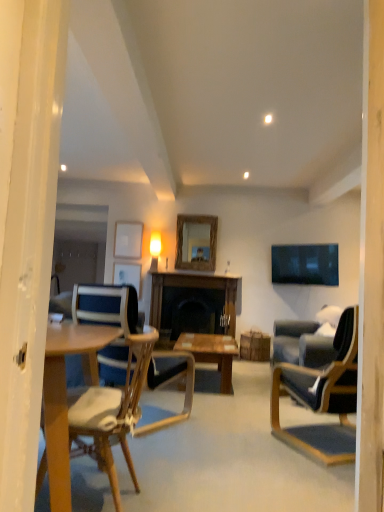
Question: Considering the relative sizes of wooden chair at center, which ranks as the first chair in left-to-right order, and rustic wood mirror at center in the image provided, is wooden chair at center, which ranks as the first chair in left-to-right order, shorter than rustic wood mirror at center?

Choices:
 (A) no
 (B) yes

Answer: (A)

Question: Is wooden chair at center, the second chair in the right-to-left sequence, outside rustic wood mirror at center?

Choices:
 (A) yes
 (B) no

Answer: (A)

Question: Can you confirm if wooden chair at center, which ranks as the first chair in left-to-right order, is thinner than rustic wood mirror at center?

Choices:
 (A) no
 (B) yes

Answer: (A)

Question: Would you say wooden chair at center, which ranks as the first chair in left-to-right order, contains rustic wood mirror at center?

Choices:
 (A) yes
 (B) no

Answer: (B)

Question: Is wooden chair at center, which ranks as the first chair in left-to-right order, facing away from rustic wood mirror at center?

Choices:
 (A) no
 (B) yes

Answer: (A)

Question: Is rustic wood mirror at center situated inside matte wooden picture frame at upper center, arranged as the 1th picture frame when ordered from the bottom, or outside?

Choices:
 (A) inside
 (B) outside

Answer: (B)

Question: From the image's perspective, is rustic wood mirror at center positioned above or below matte wooden picture frame at upper center, arranged as the 1th picture frame when ordered from the bottom?

Choices:
 (A) below
 (B) above

Answer: (B)

Question: In terms of width, does rustic wood mirror at center look wider or thinner when compared to matte wooden picture frame at upper center, the 2th picture frame in the top-to-bottom sequence?

Choices:
 (A) wide
 (B) thin

Answer: (A)

Question: In terms of height, does rustic wood mirror at center look taller or shorter compared to matte wooden picture frame at upper center, arranged as the 1th picture frame when ordered from the bottom?

Choices:
 (A) short
 (B) tall

Answer: (B)

Question: Is wooden chair at center, the second chair in the right-to-left sequence, situated inside rustic wood mirror at center or outside?

Choices:
 (A) inside
 (B) outside

Answer: (B)

Question: Looking at their shapes, would you say wooden chair at center, the second chair in the right-to-left sequence, is wider or thinner than rustic wood mirror at center?

Choices:
 (A) wide
 (B) thin

Answer: (A)

Question: From a real-world perspective, is wooden chair at center, which ranks as the first chair in left-to-right order, physically located above or below rustic wood mirror at center?

Choices:
 (A) below
 (B) above

Answer: (A)

Question: Considering the relative positions of wooden chair at center, which ranks as the first chair in left-to-right order, and rustic wood mirror at center in the image provided, is wooden chair at center, which ranks as the first chair in left-to-right order, to the left or to the right of rustic wood mirror at center?

Choices:
 (A) right
 (B) left

Answer: (B)

Question: In terms of size, does matte wooden picture frame at upper center, the 2th picture frame in the top-to-bottom sequence, appear bigger or smaller than rustic wood mirror at center?

Choices:
 (A) big
 (B) small

Answer: (B)

Question: Is matte wooden picture frame at upper center, the 2th picture frame in the top-to-bottom sequence, in front of or behind rustic wood mirror at center in the image?

Choices:
 (A) behind
 (B) front

Answer: (A)